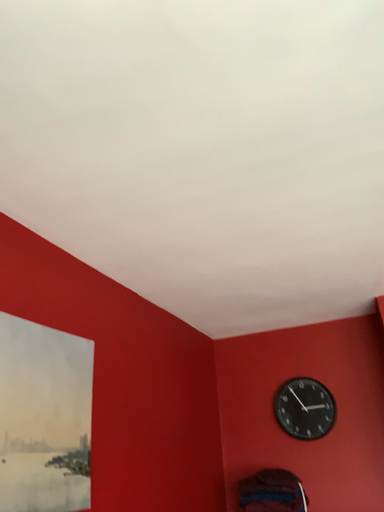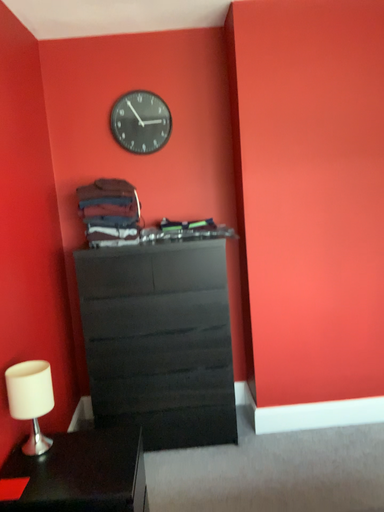
Question: Which way did the camera rotate in the video?

Choices:
 (A) rotated upward
 (B) rotated downward

Answer: (B)